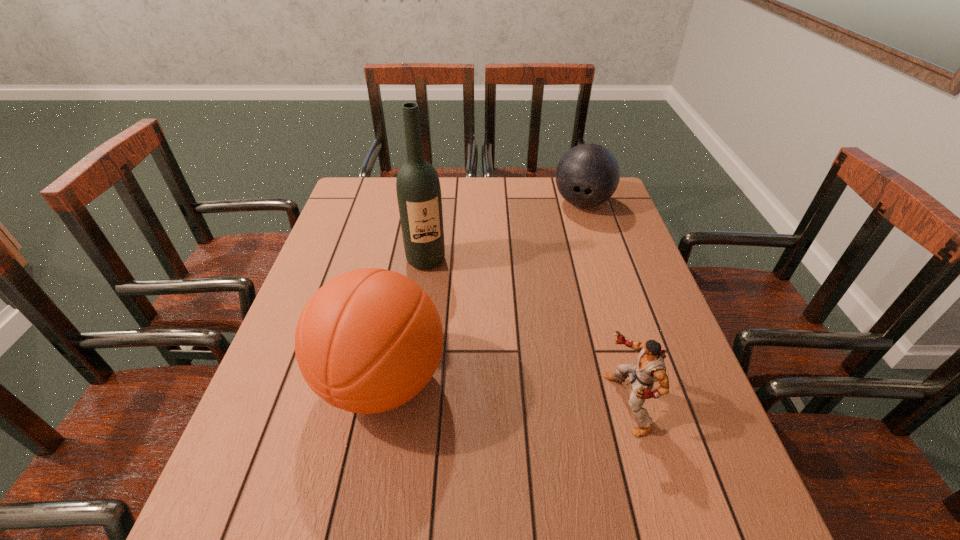
Where is `bowling ball that is positioned at the right edge`? The width and height of the screenshot is (960, 540). bowling ball that is positioned at the right edge is located at coordinates (587, 175).

The width and height of the screenshot is (960, 540). In order to click on object situated at the near left corner in this screenshot , I will do `click(369, 340)`.

The image size is (960, 540). I want to click on object at the far right corner, so click(587, 175).

At what (x,y) coordinates should I click in order to perform the action: click on object that is at the near right corner. Please return your answer as a coordinate pair (x, y). The image size is (960, 540). Looking at the image, I should click on (650, 368).

Where is `vacant area at the far edge`? Image resolution: width=960 pixels, height=540 pixels. vacant area at the far edge is located at coordinates (517, 205).

Where is `vacant region at the near edge`? vacant region at the near edge is located at coordinates (520, 470).

In the image, there is a desktop. Identify the location of vacant area at the left edge. The height and width of the screenshot is (540, 960). (286, 405).

In the image, there is a desktop. Find the location of `vacant area at the right edge`. vacant area at the right edge is located at coordinates (581, 217).

This screenshot has width=960, height=540. What are the coordinates of `free space at the far left corner of the desktop` in the screenshot? It's located at (363, 185).

In the image, there is a desktop. Where is `vacant space at the near right corner`? The width and height of the screenshot is (960, 540). vacant space at the near right corner is located at coordinates (725, 473).